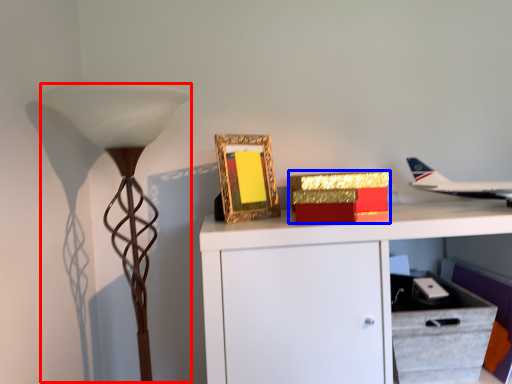
Question: Among these objects, which one is nearest to the camera, table lamp (highlighted by a red box) or box (highlighted by a blue box)?

Choices:
 (A) table lamp
 (B) box

Answer: (A)